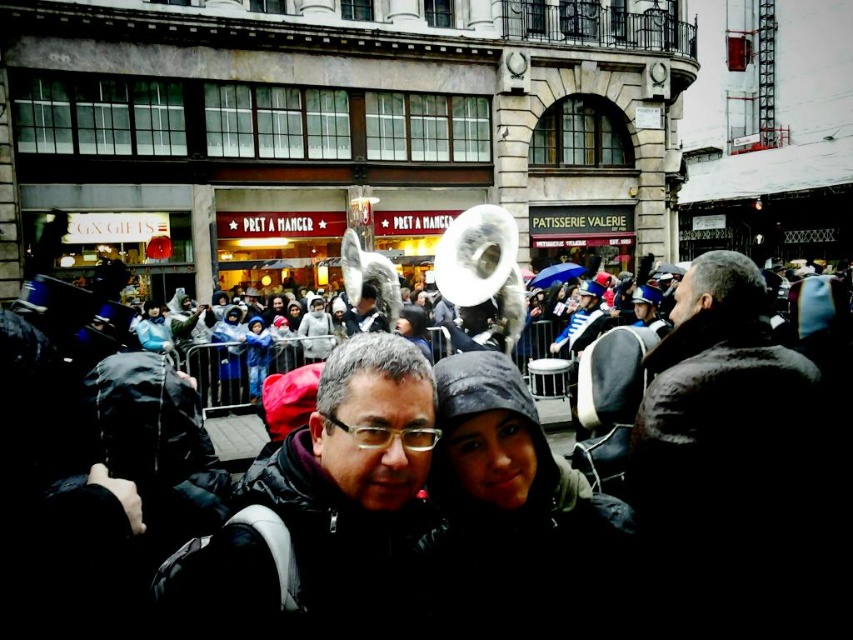
Who is lower down, matte blue jacket at center or blue fleece jacket at center?

blue fleece jacket at center

Can you confirm if matte blue jacket at center is wider than blue fleece jacket at center?

Yes, matte blue jacket at center is wider than blue fleece jacket at center.

The width and height of the screenshot is (853, 640). Describe the element at coordinates (229, 355) in the screenshot. I see `matte blue jacket at center` at that location.

The width and height of the screenshot is (853, 640). I want to click on matte blue jacket at center, so click(x=229, y=355).

Can you confirm if brown fuzzy coat at center is positioned above dark gray hooded jacket at center?

Yes.

Is point (666, 440) more distant than point (521, 634)?

Yes, point (666, 440) is behind point (521, 634).

Image resolution: width=853 pixels, height=640 pixels. What are the coordinates of `brown fuzzy coat at center` in the screenshot? It's located at (733, 468).

Is brown fuzzy coat at center shorter than matte blue jacket at center?

In fact, brown fuzzy coat at center may be taller than matte blue jacket at center.

Does brown fuzzy coat at center have a larger size compared to matte blue jacket at center?

Correct, brown fuzzy coat at center is larger in size than matte blue jacket at center.

Where is `brown fuzzy coat at center`? brown fuzzy coat at center is located at coordinates (733, 468).

You are a GUI agent. You are given a task and a screenshot of the screen. Output one action in this format:
    pyautogui.click(x=<x>, y=<y>)
    Task: Click on the brown fuzzy coat at center
    This screenshot has width=853, height=640.
    Given the screenshot: What is the action you would take?
    pyautogui.click(x=733, y=468)